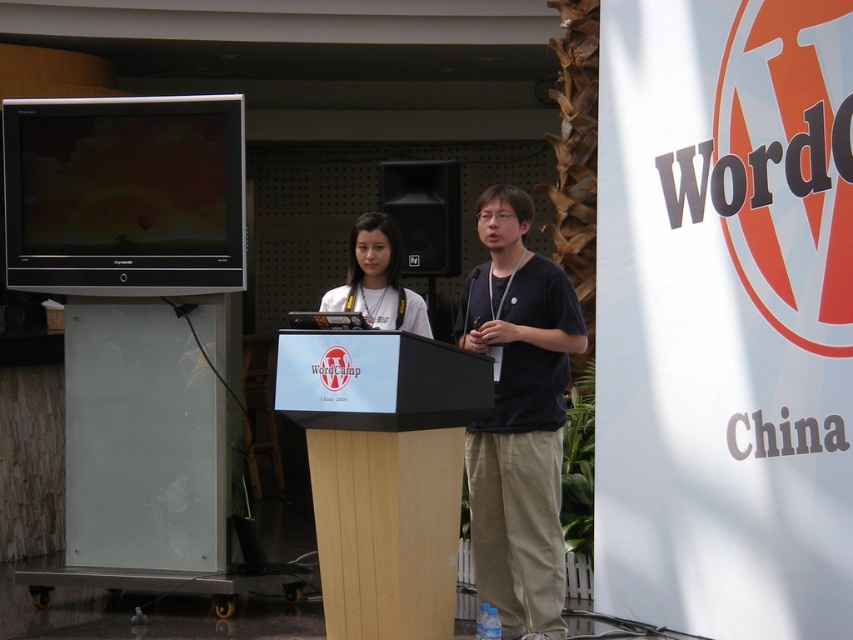
Looking at this image, you are a photographer adjusting your camera to capture the speaker at the event. You notice the light brown wood podium at center and the matte white shirt at center. Based on their distance, can you estimate if the two are within the camera lens focal length of 50 inches?

The light brown wood podium at center and the matte white shirt at center are 36.05 inches apart from each other, which is within the camera lens focal length of 50 inches. Therefore, both objects can be captured clearly in the same frame.